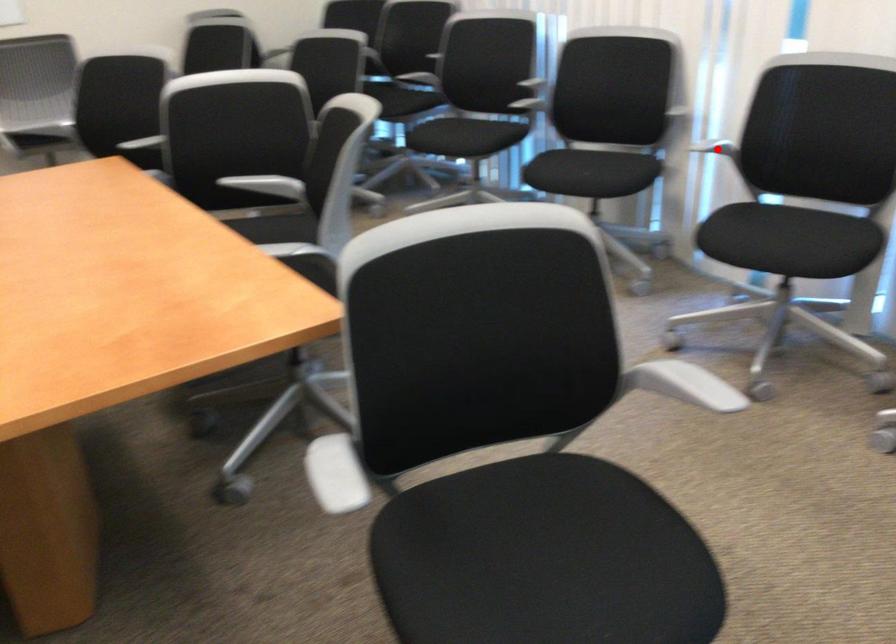
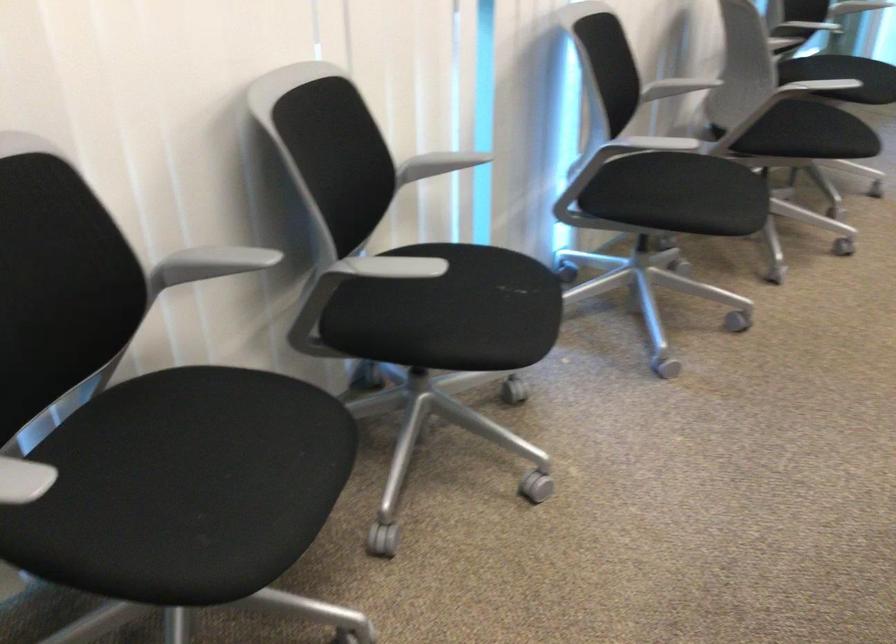
Question: I am providing you with two images of the same scene from different viewpoints. A red point is marked on the first image. Is the red point's position out of view in image 2?

Choices:
 (A) Yes
 (B) No

Answer: (A)